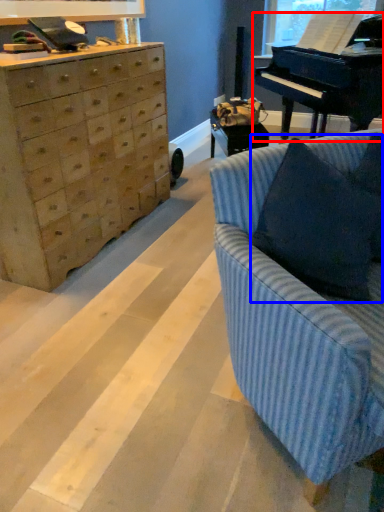
Question: Which of the following is the farthest to the observer, piano (highlighted by a red box) or pillow (highlighted by a blue box)?

Choices:
 (A) piano
 (B) pillow

Answer: (A)